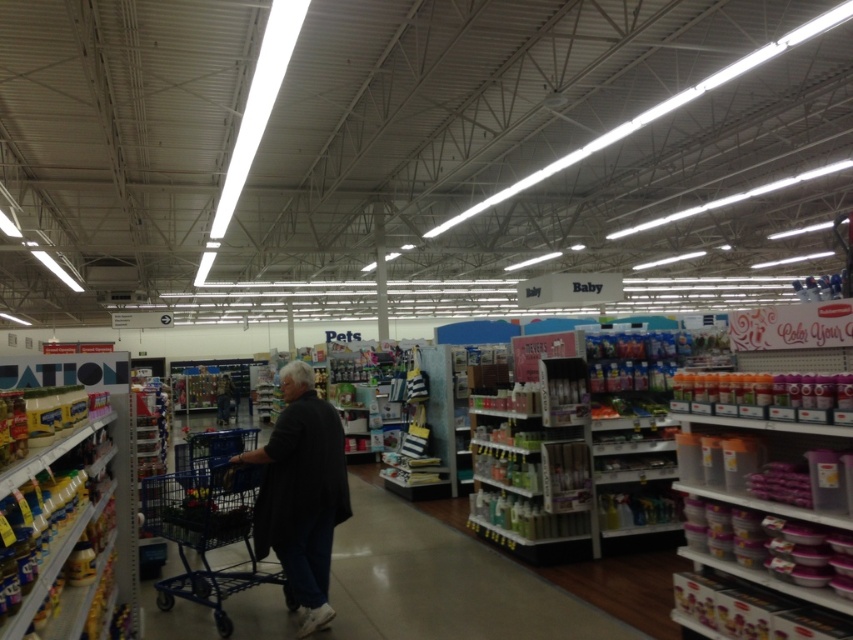
Question: Among these points, which one is nearest to the camera?

Choices:
 (A) (218, 404)
 (B) (202, 497)
 (C) (80, 625)
 (D) (312, 452)

Answer: (C)

Question: Among these points, which one is nearest to the camera?

Choices:
 (A) (206, 483)
 (B) (68, 584)
 (C) (229, 387)
 (D) (300, 376)

Answer: (B)

Question: Which object is positioned farthest from the dark gray shirt at center?

Choices:
 (A) metallic yellow canisters at left
 (B) blue metal shopping cart at center

Answer: (A)

Question: Where is metallic yellow canisters at left located in relation to black fabric person at center in the image?

Choices:
 (A) below
 (B) above

Answer: (B)

Question: Is metallic yellow canisters at left positioned at the back of black fabric person at center?

Choices:
 (A) yes
 (B) no

Answer: (B)

Question: Does blue metal shopping cart at center appear on the left side of black fabric person at center?

Choices:
 (A) no
 (B) yes

Answer: (A)